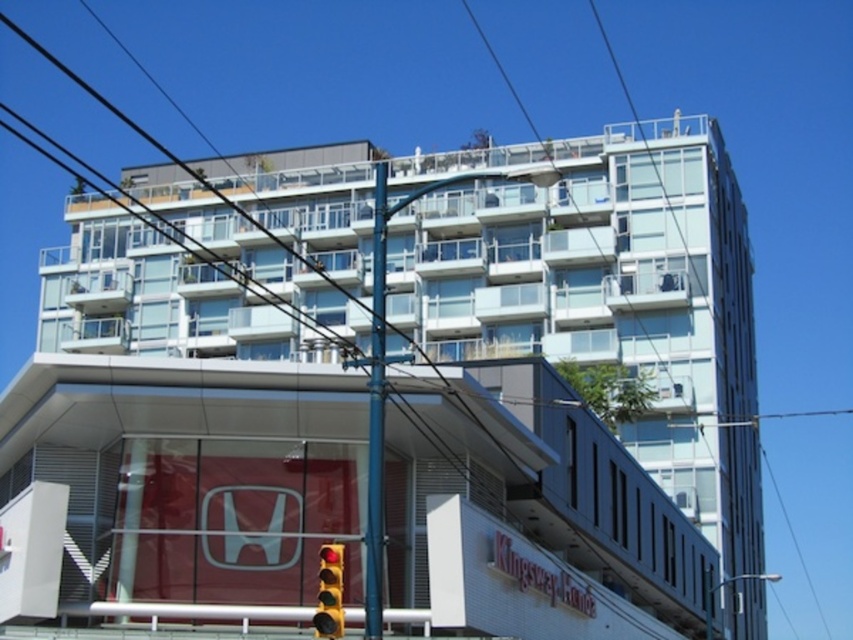
You are an architect reviewing the building plans. You notice the transparent glass building at center and the clear blue wire at upper center. According to the description, which object is positioned higher in the image?

The transparent glass building at center is positioned higher than the clear blue wire at upper center according to the description.